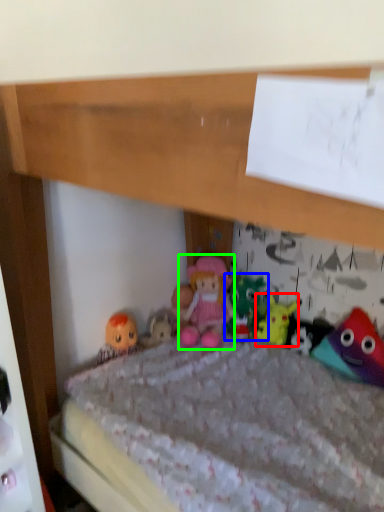
Question: Which object is the closest to the toy (highlighted by a red box)? Choose among these: toy (highlighted by a blue box) or person (highlighted by a green box).

Choices:
 (A) toy
 (B) person

Answer: (A)